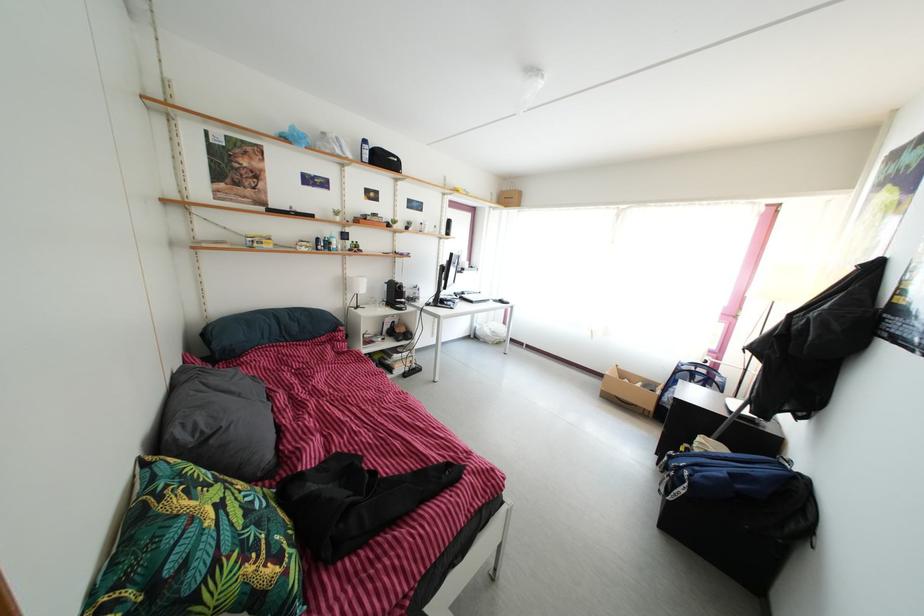
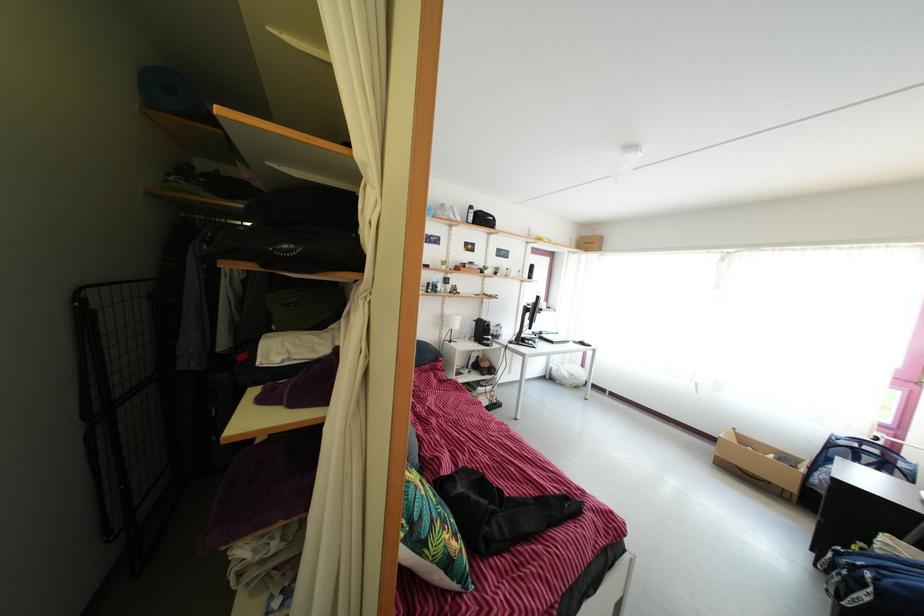
Locate, in the second image, the point that corresponds to (x=223, y=570) in the first image.

(439, 531)